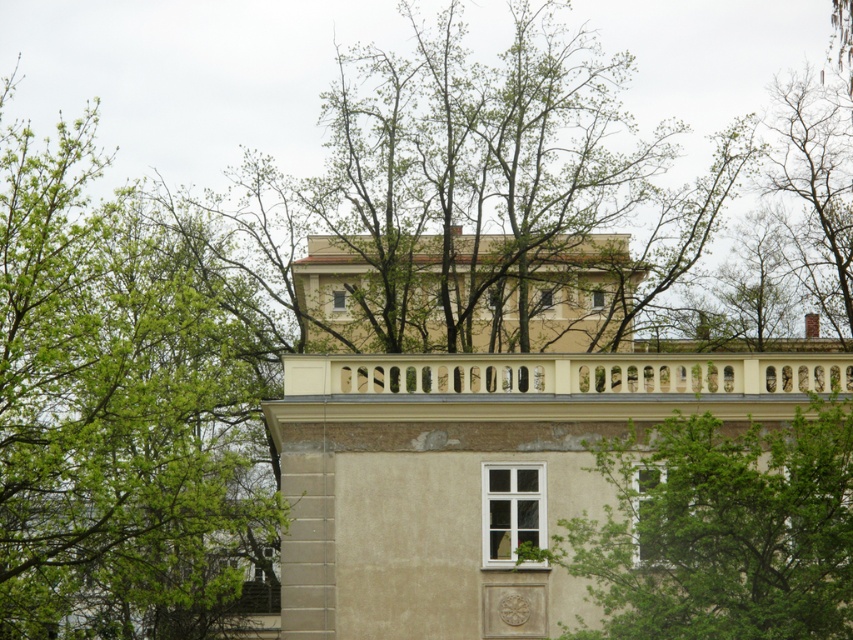
Does green leafy tree at upper left appear under beige stone balcony at upper center?

Yes.

Does green leafy tree at upper left have a lesser width compared to beige stone balcony at upper center?

Yes.

The width and height of the screenshot is (853, 640). I want to click on green leafy tree at upper left, so [x=119, y=408].

Where is `green leafy tree at upper left`? The height and width of the screenshot is (640, 853). green leafy tree at upper left is located at coordinates (119, 408).

Is beige stone balcony at upper center smaller than green leafy tree at center?

Actually, beige stone balcony at upper center might be larger than green leafy tree at center.

Is point (706, 408) closer to viewer compared to point (683, 579)?

No, it is not.

Does point (345, 611) come behind point (647, 593)?

Yes.

What are the coordinates of `beige stone balcony at upper center` in the screenshot? It's located at (477, 474).

Who is lower down, green leafy tree at upper left or green leafy tree at center?

green leafy tree at center

Between point (177, 269) and point (811, 500), which one is positioned behind?

The point (177, 269) is behind.

Who is more forward, (190, 326) or (825, 419)?

Positioned in front is point (825, 419).

At what (x,y) coordinates should I click in order to perform the action: click on green leafy tree at upper left. Please return your answer as a coordinate pair (x, y). Image resolution: width=853 pixels, height=640 pixels. Looking at the image, I should click on (119, 408).